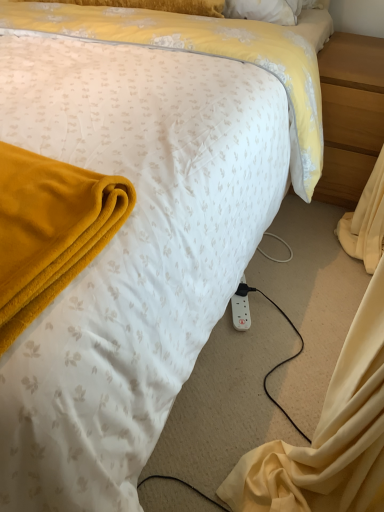
At what (x,y) coordinates should I click in order to perform the action: click on free spot to the right of white plastic power outlet at lower right. Please return your answer as a coordinate pair (x, y). Looking at the image, I should click on tap(286, 300).